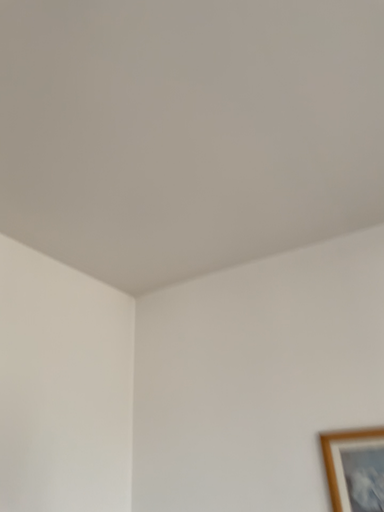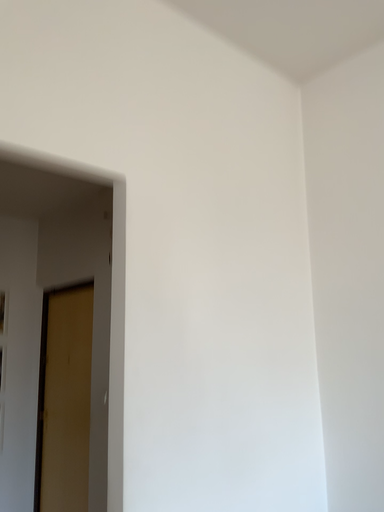
Question: How did the camera likely rotate when shooting the video?

Choices:
 (A) rotated right
 (B) rotated left

Answer: (B)